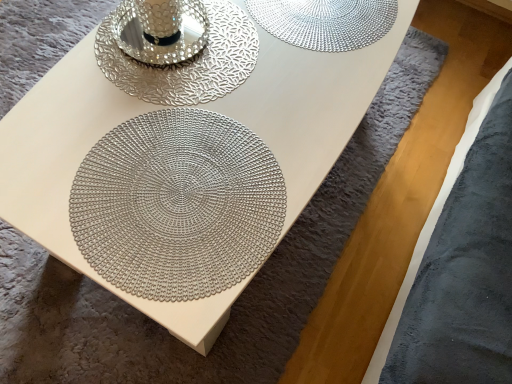
Where is `free region under metallic silver mandala at center (from a real-world perspective)`? This screenshot has width=512, height=384. free region under metallic silver mandala at center (from a real-world perspective) is located at coordinates (170, 189).